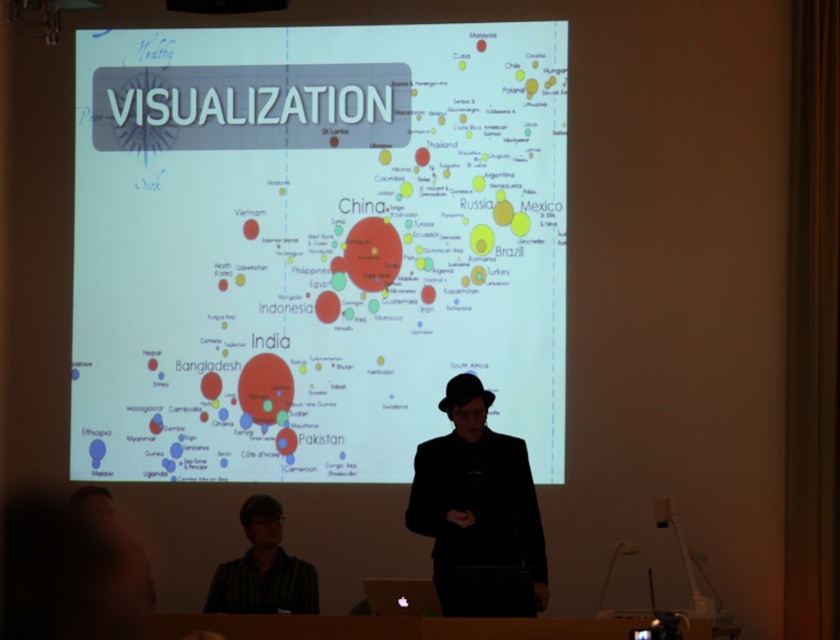
Does black matte suit at center have a lesser height compared to silver metallic laptop at center?

No.

Which is more to the right, black matte suit at center or silver metallic laptop at center?

black matte suit at center is more to the right.

Who is more distant from viewer, (415,504) or (379,589)?

Point (415,504)

The image size is (840, 640). What are the coordinates of `black matte suit at center` in the screenshot? It's located at (475, 497).

Which of these two, striped shirt at lower left or black plastic projector at upper center, stands taller?

With more height is striped shirt at lower left.

Which is more to the left, striped shirt at lower left or black plastic projector at upper center?

Positioned to the left is black plastic projector at upper center.

At what (x,y) coordinates should I click in order to perform the action: click on striped shirt at lower left. Please return your answer as a coordinate pair (x, y). This screenshot has width=840, height=640. Looking at the image, I should click on (263, 568).

Find the location of a particular element. This screenshot has width=840, height=640. striped shirt at lower left is located at coordinates (263, 568).

Is matte white map at center positioned in front of black matte suit at center?

That is False.

Does point (324, 410) come farther from viewer compared to point (407, 520)?

Yes, it is behind point (407, 520).

This screenshot has width=840, height=640. I want to click on matte white map at center, so click(315, 246).